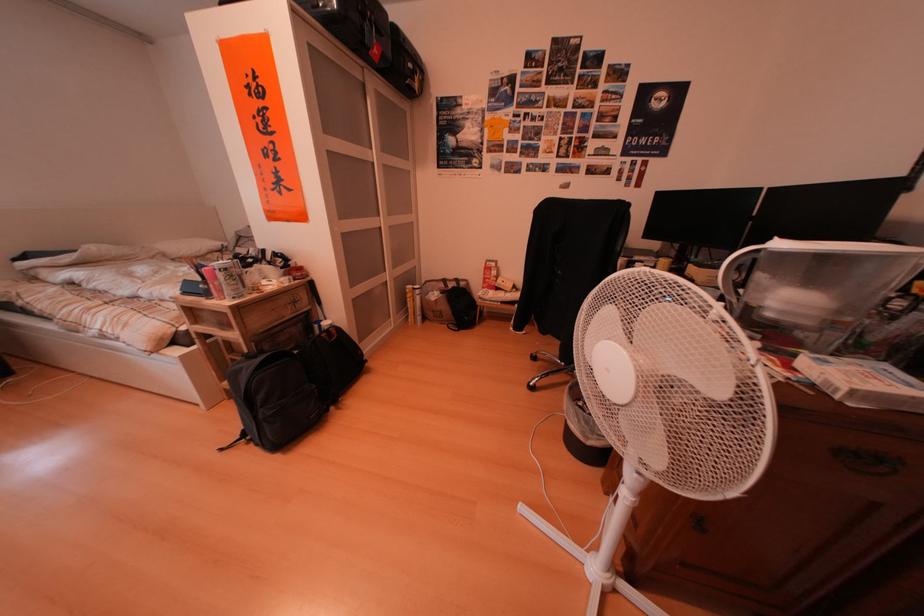
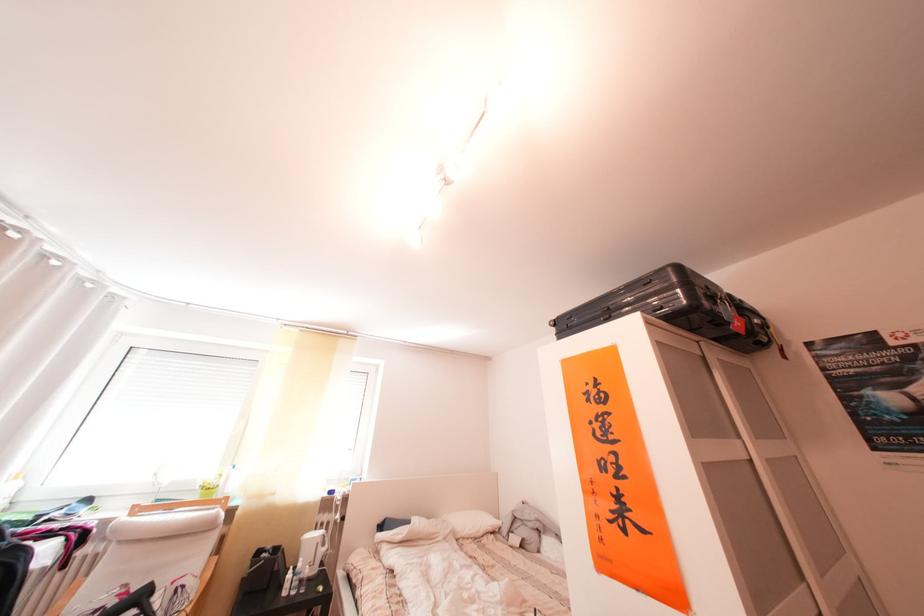
In the second image, find the point that corresponds to point (277, 195) in the first image.

(610, 522)